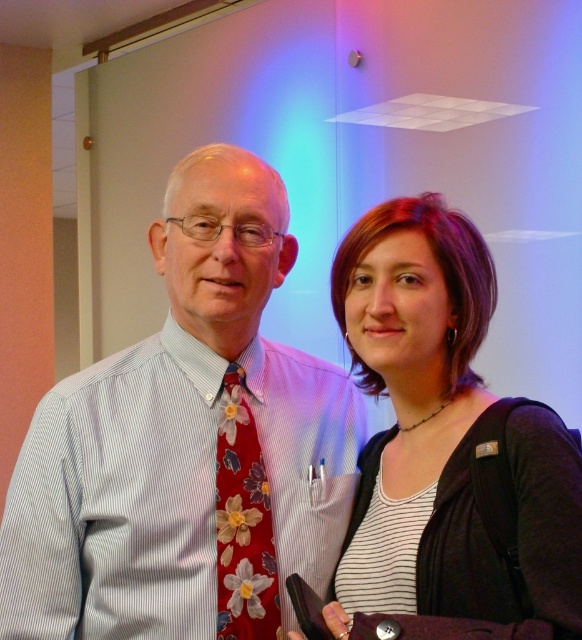
Is matte black backpack at center above floral silk tie at center?

Yes, matte black backpack at center is above floral silk tie at center.

Is matte black backpack at center smaller than floral silk tie at center?

Actually, matte black backpack at center might be larger than floral silk tie at center.

The image size is (582, 640). In order to click on matte black backpack at center in this screenshot , I will do `click(448, 449)`.

Between point (161, 362) and point (406, 332), which one is positioned behind?

The point (161, 362) is more distant.

Who is more forward, (205, 436) or (432, 580)?

Point (432, 580)

This screenshot has width=582, height=640. Identify the location of floral tie at center. [186, 444].

Does floral tie at center lie in front of floral silk tie at center?

Yes, it is.

Can you confirm if floral tie at center is positioned to the right of floral silk tie at center?

No, floral tie at center is not to the right of floral silk tie at center.

I want to click on floral tie at center, so click(x=186, y=444).

Where is `floral tie at center`? The image size is (582, 640). floral tie at center is located at coordinates (186, 444).